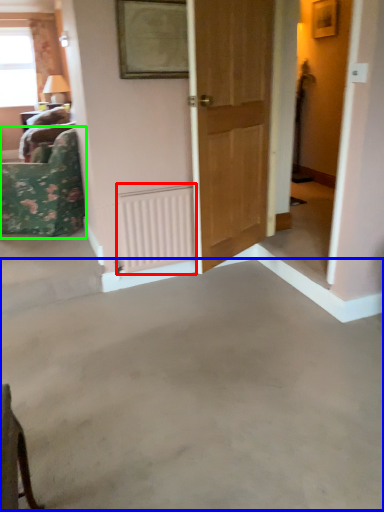
Question: Considering the real-world distances, which object is closest to radiator (highlighted by a red box)? concrete (highlighted by a blue box) or furniture (highlighted by a green box).

Choices:
 (A) concrete
 (B) furniture

Answer: (B)